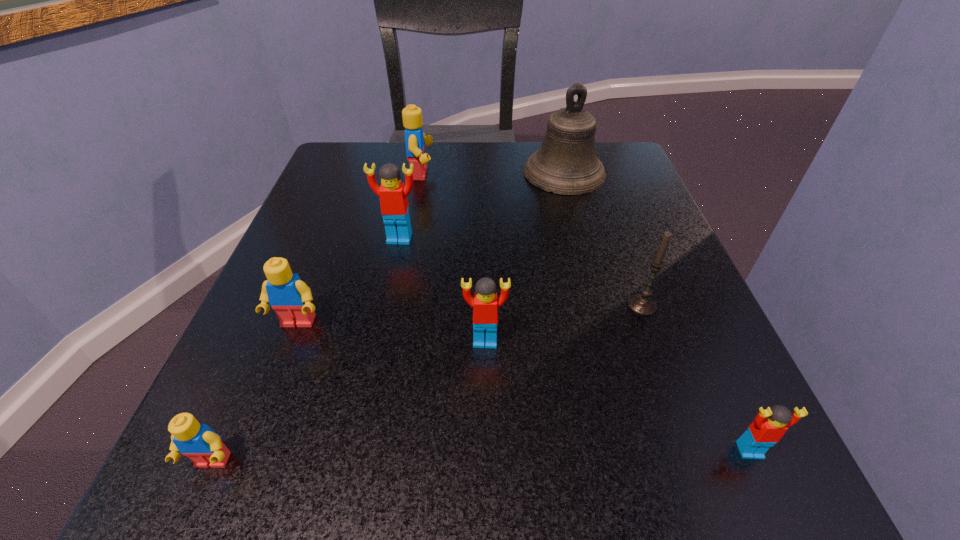
This screenshot has height=540, width=960. I want to click on the rightmost Lego, so click(x=769, y=425).

Where is `the nearest yellow Lego`? Image resolution: width=960 pixels, height=540 pixels. the nearest yellow Lego is located at coordinates (203, 446).

You are a GUI agent. You are given a task and a screenshot of the screen. Output one action in this format:
    pyautogui.click(x=<x>, y=<y>)
    Task: Click on the vacant space located on the left of the tallest object
    This screenshot has width=960, height=540.
    Given the screenshot: What is the action you would take?
    pyautogui.click(x=427, y=173)

This screenshot has width=960, height=540. Find the location of `vacant space positioned 0.350m on the face of the third farthest object`. vacant space positioned 0.350m on the face of the third farthest object is located at coordinates (360, 429).

At what (x,y) coordinates should I click in order to perform the action: click on vacant region located 0.090m on the front-facing side of the farthest Lego. Please return your answer as a coordinate pair (x, y). This screenshot has width=960, height=540. Looking at the image, I should click on (475, 174).

Where is `free location located on the front of the candle`? The image size is (960, 540). free location located on the front of the candle is located at coordinates (683, 420).

The height and width of the screenshot is (540, 960). Find the location of `free space located 0.060m on the face of the second smallest red Lego`. free space located 0.060m on the face of the second smallest red Lego is located at coordinates (486, 386).

At what (x,y) coordinates should I click in order to perform the action: click on blank area located 0.160m on the front-facing side of the second smallest yellow Lego. Please return your answer as a coordinate pair (x, y). The image size is (960, 540). Looking at the image, I should click on [x=252, y=440].

Where is `bell that is positioned at the far edge`? bell that is positioned at the far edge is located at coordinates (566, 163).

Locate an element on the screen. Lego positioned at the far edge is located at coordinates (415, 140).